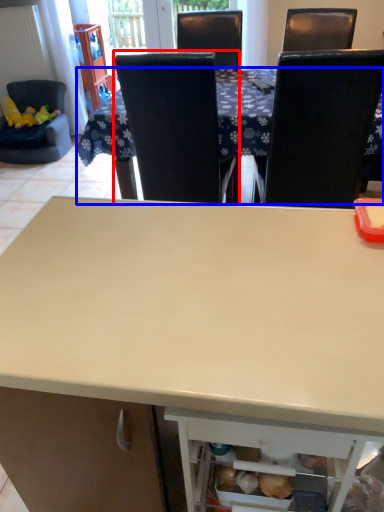
Question: Among these objects, which one is nearest to the camera, chair (highlighted by a red box) or table (highlighted by a blue box)?

Choices:
 (A) chair
 (B) table

Answer: (A)